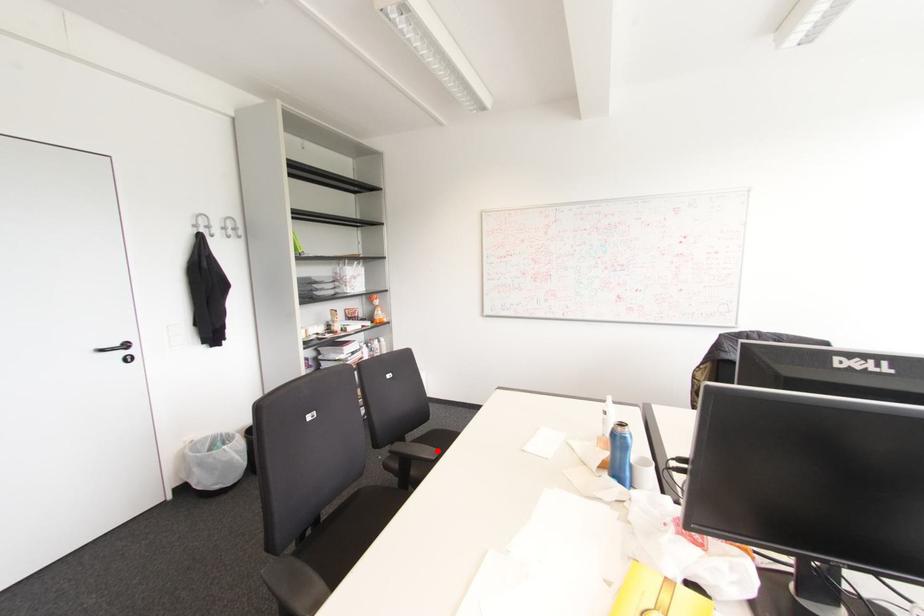
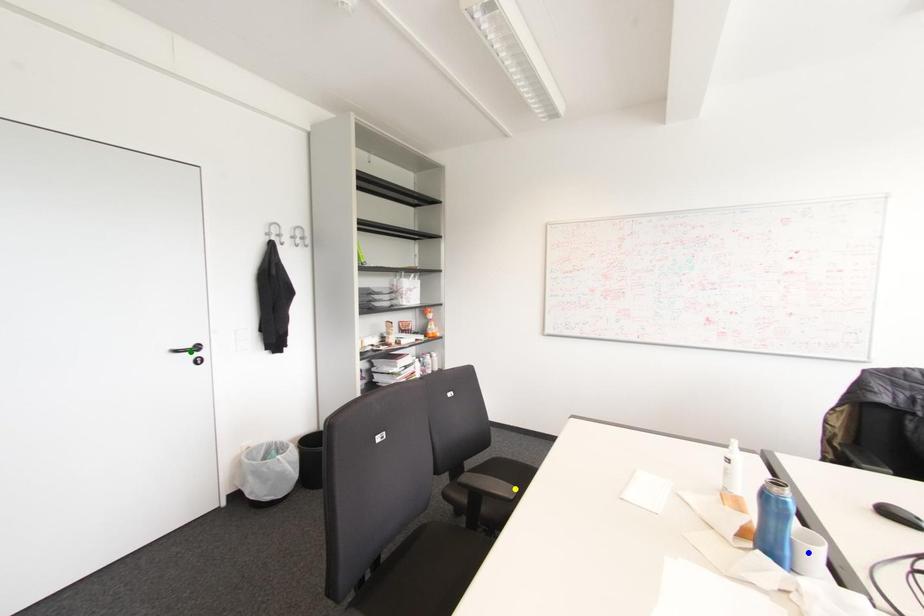
Question: I am providing you with two images of the same scene from different viewpoints. A red point is marked on the first image. You are given multiple points on the second image. In image 2, which mark is for the same physical point as the one in image 1?

Choices:
 (A) green point
 (B) blue point
 (C) yellow point

Answer: (C)